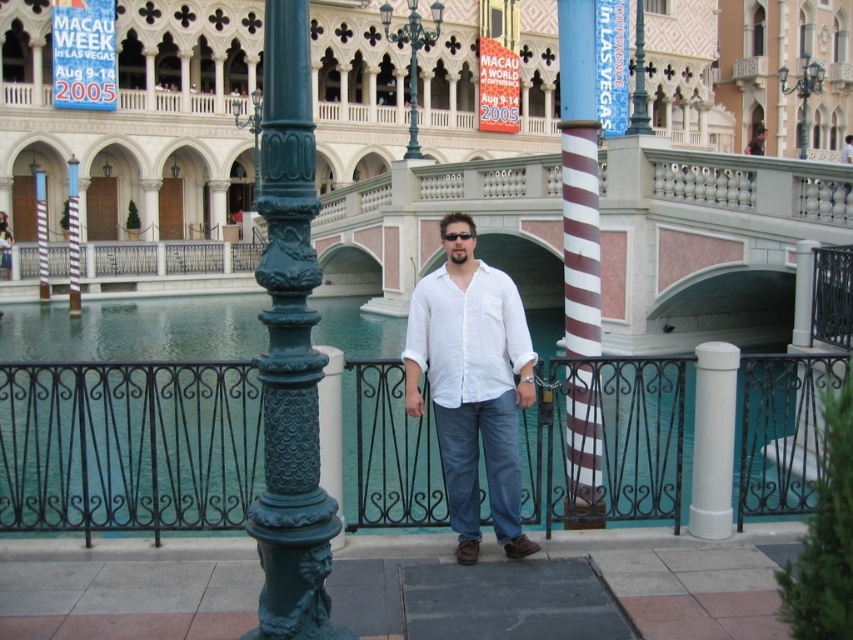
Question: Which object is closer to the camera taking this photo?

Choices:
 (A) striped wood post at center
 (B) blue fabric banner at upper center
 (C) green metal streetlight at center

Answer: (B)

Question: Does green metal streetlight at center appear under striped wood post at center?

Choices:
 (A) no
 (B) yes

Answer: (A)

Question: Does white marble palace at center appear on the left side of green ornate pole at center?

Choices:
 (A) yes
 (B) no

Answer: (B)

Question: Which object appears farthest from the camera in this image?

Choices:
 (A) green metal streetlight at center
 (B) white smooth cylinder at center

Answer: (A)

Question: Which point is farther to the camera?

Choices:
 (A) green cast iron lamp post at center
 (B) white marble palace at center
 (C) blue fabric banner at upper center
 (D) green ornate pole at center

Answer: (A)

Question: Does green metal streetlight at upper right have a greater width compared to green cast iron lamp post at center?

Choices:
 (A) yes
 (B) no

Answer: (A)